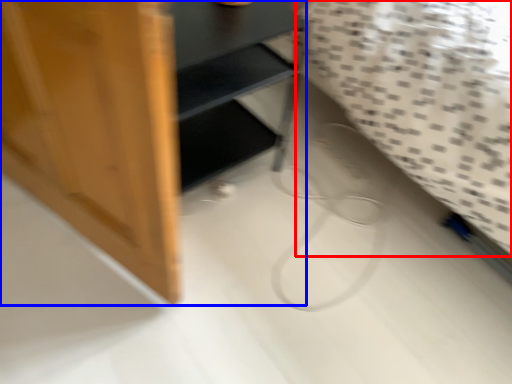
Question: Which object is closer to the camera taking this photo, sheet (highlighted by a red box) or furniture (highlighted by a blue box)?

Choices:
 (A) sheet
 (B) furniture

Answer: (A)